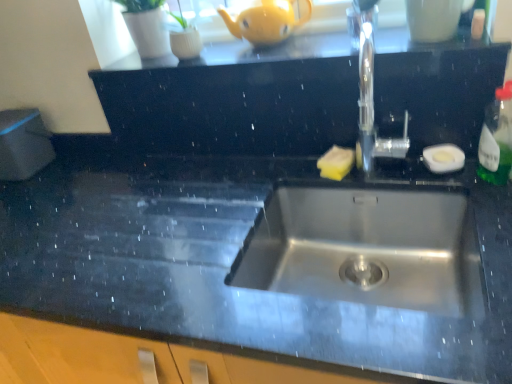
The height and width of the screenshot is (384, 512). In order to click on vacant space in front of green translucent bottle at right in this screenshot , I will do `click(493, 208)`.